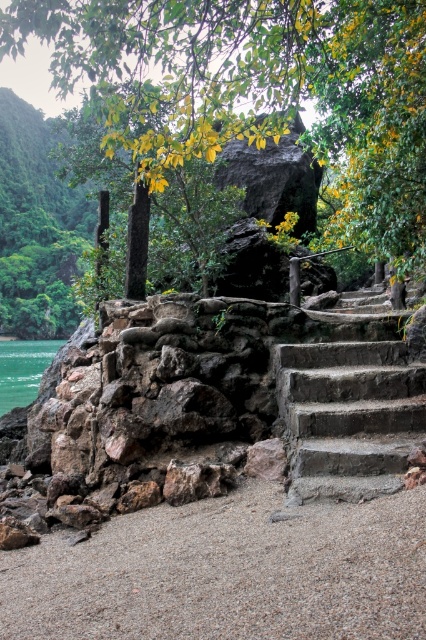
Which is behind, point (239, 70) or point (342, 499)?

Positioned behind is point (239, 70).

Who is shorter, green leafy tree at upper center or dark gray concrete stairs at right?

green leafy tree at upper center is shorter.

Find the location of `green leafy tree at upper center`. green leafy tree at upper center is located at coordinates (255, 90).

Does point (9, 32) come farther from viewer compared to point (307, 541)?

Yes, it is.

Who is more forward, (106, 90) or (253, 611)?

Positioned in front is point (253, 611).

You are a GUI agent. You are given a task and a screenshot of the screen. Output one action in this format:
    pyautogui.click(x=<x>, y=<y>)
    Task: Click on the green leafy tree at upper center
    The height and width of the screenshot is (640, 426).
    Given the screenshot: What is the action you would take?
    pyautogui.click(x=255, y=90)

Can you confirm if smooth sand at lower center is smaller than dark gray concrete stairs at right?

Yes.

Is point (270, 628) closer to camera compared to point (291, 499)?

Yes, point (270, 628) is in front of point (291, 499).

This screenshot has height=640, width=426. Identify the location of smooth sand at lower center. (227, 572).